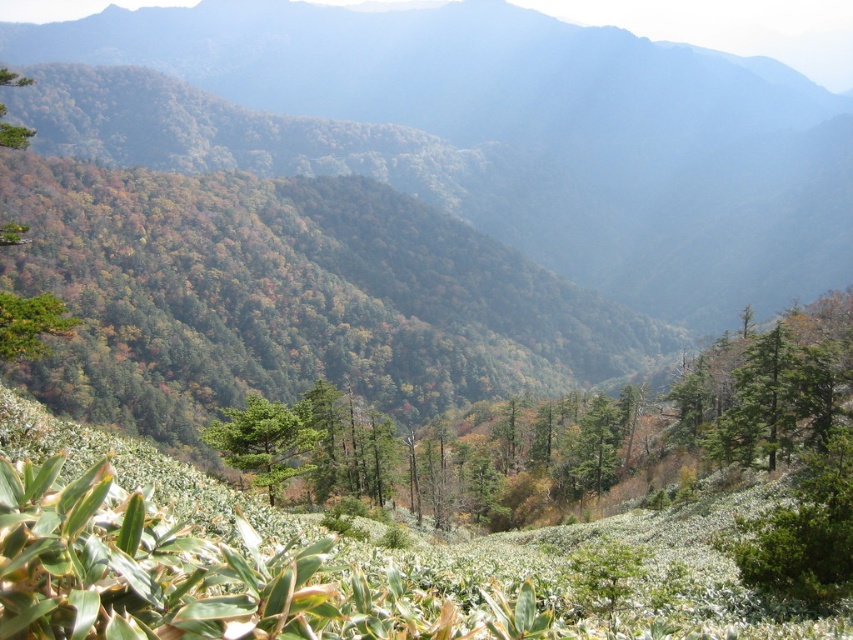
Question: Does green matte tree at center appear on the right side of green matte tree at center-right?

Choices:
 (A) yes
 (B) no

Answer: (B)

Question: Among these objects, which one is farthest from the camera?

Choices:
 (A) green matte tree at center-right
 (B) green matte tree at center

Answer: (A)

Question: Which object appears closest to the camera in this image?

Choices:
 (A) green matte tree at center
 (B) green matte tree at center-right

Answer: (A)

Question: Can you confirm if green matte tree at center is positioned to the right of green matte tree at center-right?

Choices:
 (A) no
 (B) yes

Answer: (A)

Question: Among these objects, which one is nearest to the camera?

Choices:
 (A) green matte tree at center-right
 (B) green matte tree at center

Answer: (B)

Question: Does green matte tree at center come in front of green matte tree at center-right?

Choices:
 (A) yes
 (B) no

Answer: (A)